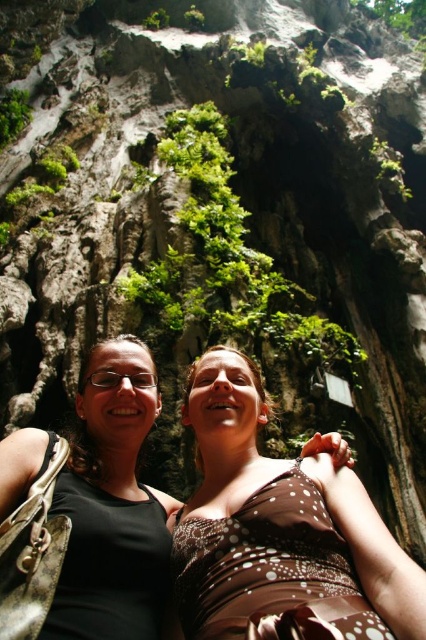
Is brown dotted dress at center to the left of black fabric at center from the viewer's perspective?

No, brown dotted dress at center is not to the left of black fabric at center.

How much distance is there between brown dotted dress at center and black fabric at center?

brown dotted dress at center and black fabric at center are 2.63 meters apart from each other.

Is point (259, 582) behind point (83, 608)?

Yes, point (259, 582) is behind point (83, 608).

This screenshot has height=640, width=426. Find the location of `brown dotted dress at center`. brown dotted dress at center is located at coordinates (281, 531).